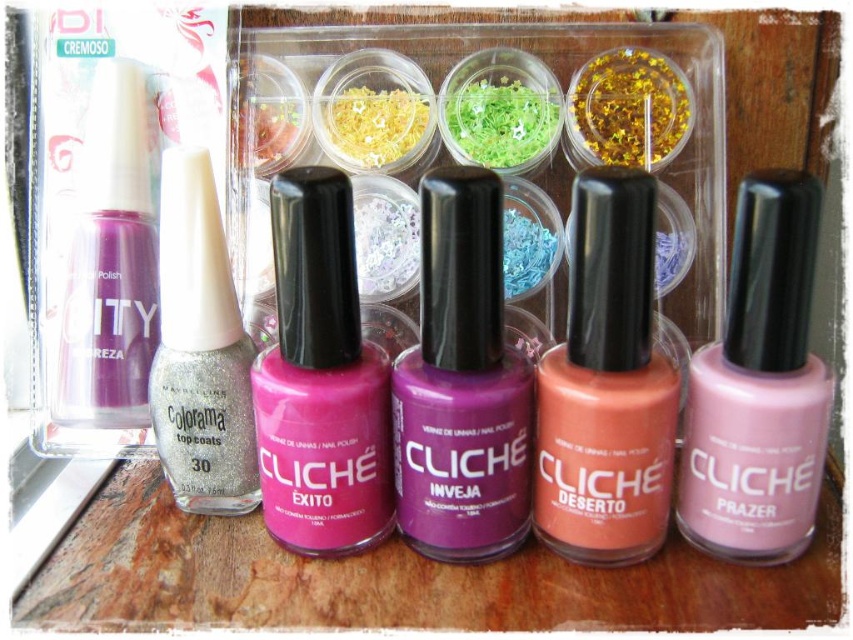
Is purple matte nail polish at center to the right of matte pink nail polish at center from the viewer's perspective?

Yes, purple matte nail polish at center is to the right of matte pink nail polish at center.

Between purple matte nail polish at center and matte pink nail polish at center, which one has less height?

With less height is matte pink nail polish at center.

The image size is (853, 640). I want to click on purple matte nail polish at center, so click(461, 384).

Can you confirm if matte purple nail polish at left is bigger than glittery silver nail polish at center?

No.

Is point (86, 397) behind point (253, 456)?

Yes.

Locate an element on the screen. matte purple nail polish at left is located at coordinates (109, 262).

Between point (607, 438) and point (171, 365), which one is positioned behind?

Point (171, 365)

Can you confirm if matte coral nail polish at center is shorter than glittery silver nail polish at center?

In fact, matte coral nail polish at center may be taller than glittery silver nail polish at center.

Who is more distant from viewer, (x=582, y=404) or (x=173, y=196)?

Positioned behind is point (x=173, y=196).

Identify the location of matte coral nail polish at center. (606, 385).